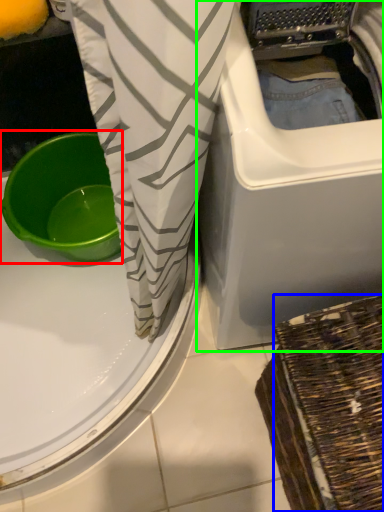
Question: Which object is positioned closest to basin (highlighted by a red box)? Select from basket (highlighted by a blue box) and washing machine (highlighted by a green box).

Choices:
 (A) basket
 (B) washing machine

Answer: (B)